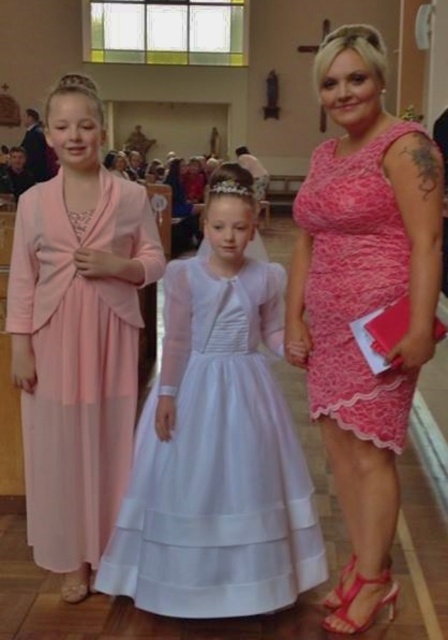
You are planning to arrange the seating for the First Communion ceremony. The pew has limited space. Which of the two dresses, the white satin dress at center or the matte pink dress at left, requires more space due to its size?

The white satin dress at center requires more space because it is bigger than the matte pink dress at left.

You are a photographer positioned at the back of the church. You need to capture a photo that includes both the matte pink dress at left and the pink lace dress at right. Which dress should you focus on first to ensure both are in frame?

The matte pink dress at left is below the pink lace dress at right, so you should focus on the pink lace dress at right first to ensure both are in frame.